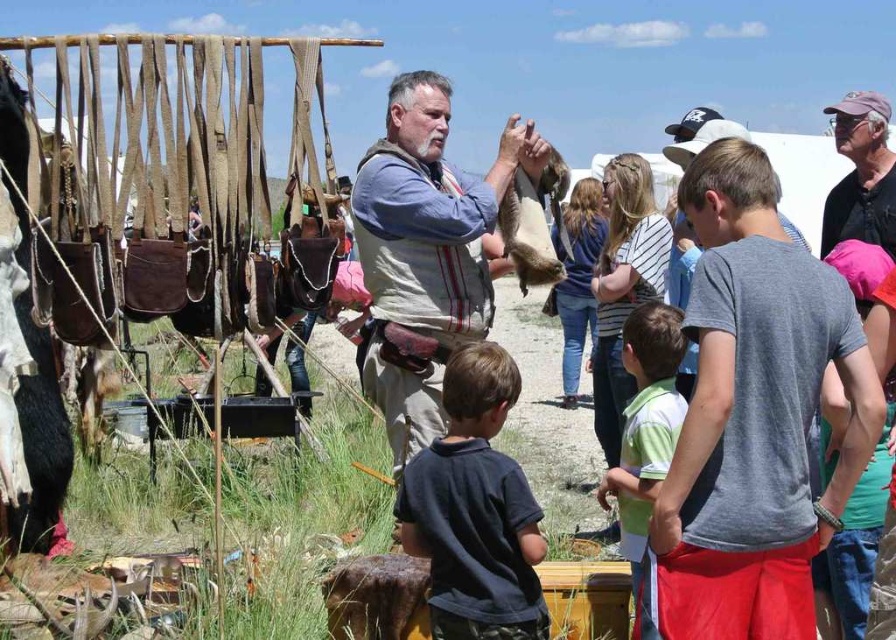
The height and width of the screenshot is (640, 896). Describe the element at coordinates (426, 252) in the screenshot. I see `brown leather vest at center` at that location.

At what (x,y) coordinates should I click in order to perform the action: click on brown leather vest at center. Please return your answer as a coordinate pair (x, y). Looking at the image, I should click on (426, 252).

Can you confirm if brown leather vest at center is smaller than dark blue cotton shirt at lower center?

Incorrect, brown leather vest at center is not smaller in size than dark blue cotton shirt at lower center.

Is brown leather vest at center above dark blue cotton shirt at lower center?

Correct, brown leather vest at center is located above dark blue cotton shirt at lower center.

The width and height of the screenshot is (896, 640). I want to click on brown leather vest at center, so click(426, 252).

Does dark gray shirt at right appear on the right side of brown leather animal at center?

Correct, you'll find dark gray shirt at right to the right of brown leather animal at center.

Where is `dark gray shirt at right`? dark gray shirt at right is located at coordinates (860, 196).